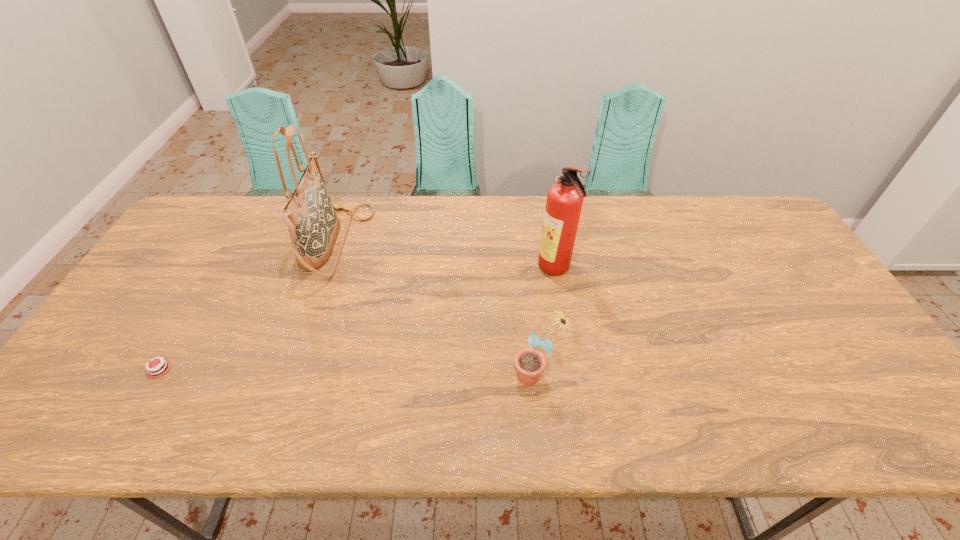
Locate an element on the screen. Image resolution: width=960 pixels, height=540 pixels. vacant space situated on the flower of the sunflower is located at coordinates (463, 375).

At what (x,y) coordinates should I click in order to perform the action: click on vacant area situated 0.250m on the flower of the sunflower. Please return your answer as a coordinate pair (x, y). Looking at the image, I should click on (408, 375).

The image size is (960, 540). In order to click on vacant space located 0.090m on the back of the chocolate cake in this screenshot , I will do `click(187, 320)`.

This screenshot has width=960, height=540. In order to click on object at the far edge in this screenshot , I will do `click(313, 225)`.

Where is `object present at the left edge`? object present at the left edge is located at coordinates (156, 369).

Image resolution: width=960 pixels, height=540 pixels. Find the location of `vacant space at the far edge of the desktop`. vacant space at the far edge of the desktop is located at coordinates (441, 223).

The image size is (960, 540). In order to click on vacant space at the left edge of the desktop in this screenshot , I will do `click(156, 317)`.

The width and height of the screenshot is (960, 540). Identify the location of vacant space at the right edge of the desktop. (825, 387).

Find the location of a particular element. vacant space at the far left corner of the desktop is located at coordinates (225, 208).

In the image, there is a desktop. In order to click on vacant space at the near left corner in this screenshot , I will do `click(66, 410)`.